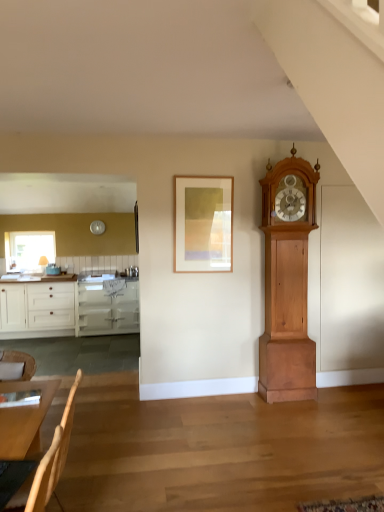
Where is `empty space that is to the right of light brown wooden grandfather clock at right`? This screenshot has height=512, width=384. empty space that is to the right of light brown wooden grandfather clock at right is located at coordinates point(338,395).